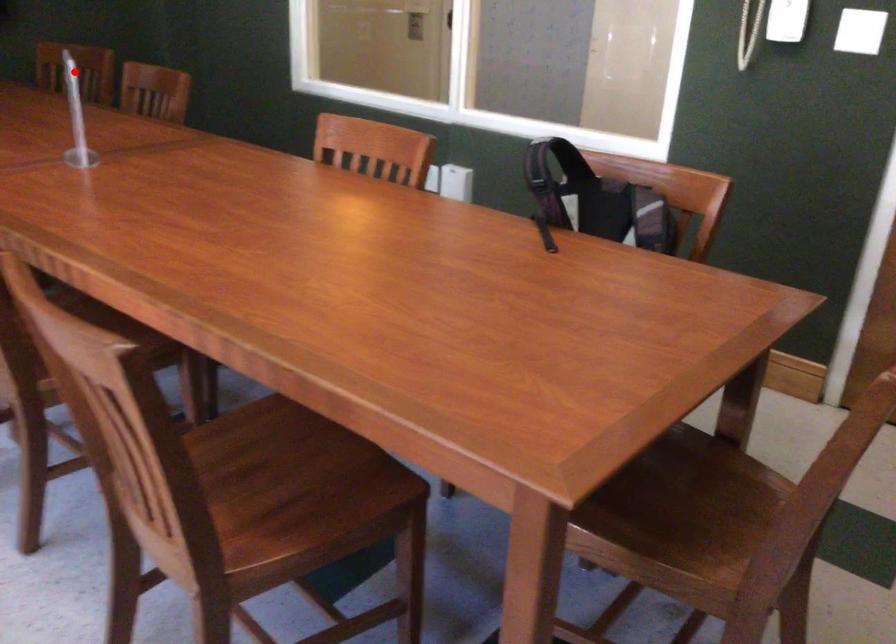
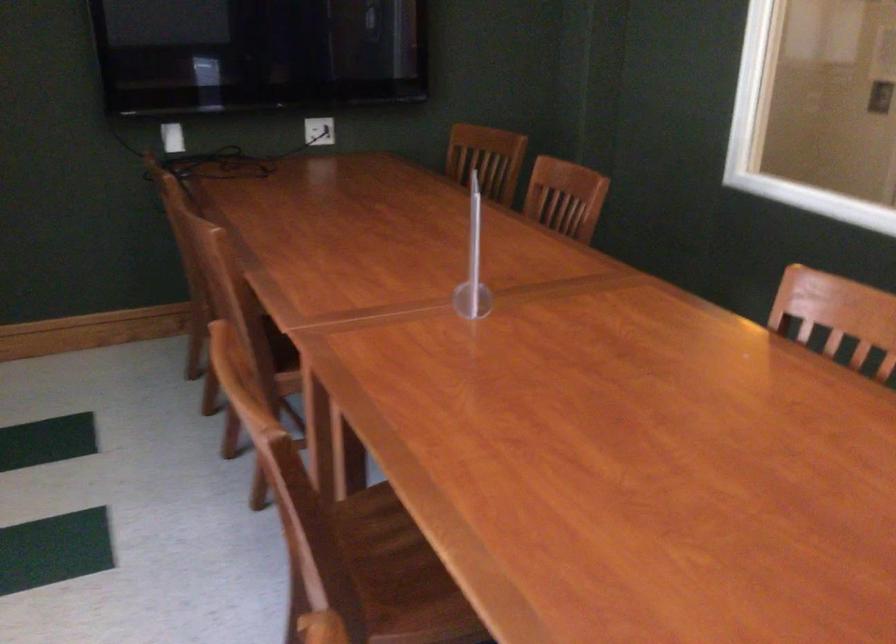
Where in the second image is the point corresponding to the highlighted location from the first image?

(487, 158)